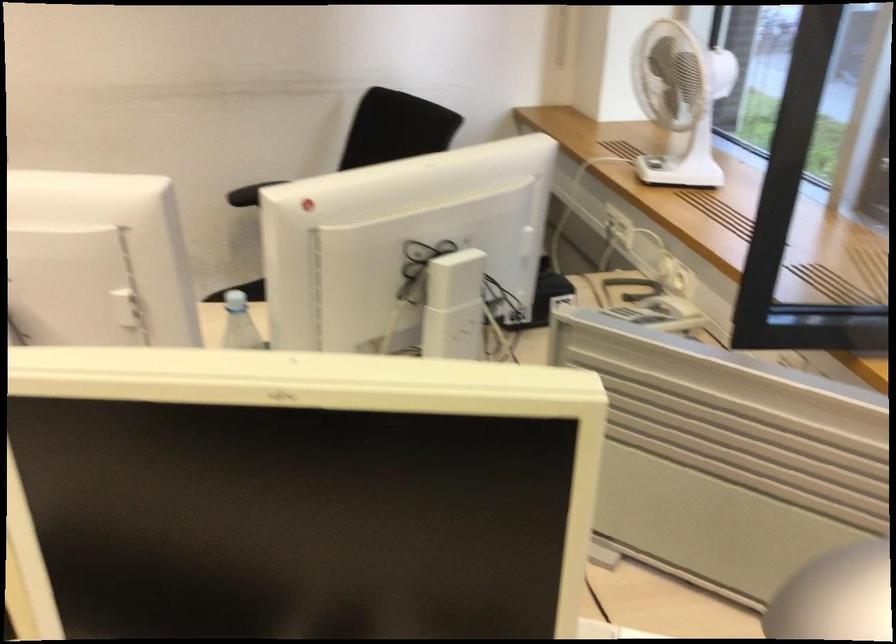
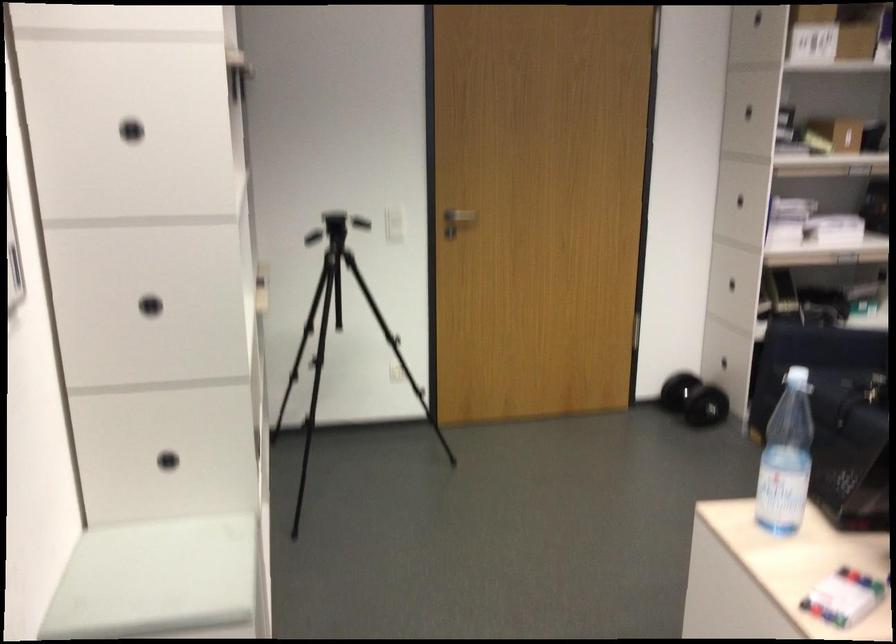
Based on the continuous images, in which direction is the camera rotating?

The rotation direction of the camera is left-down.